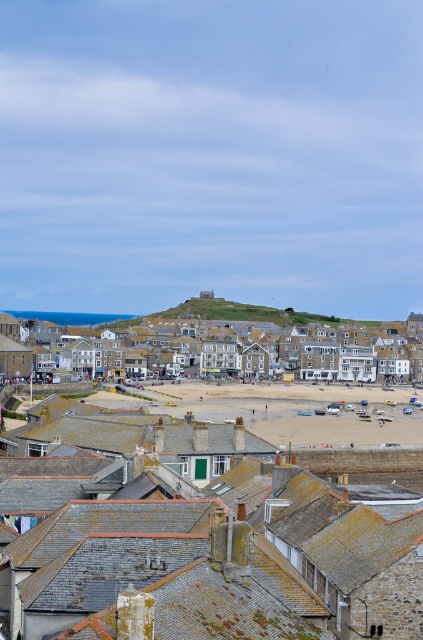
From the picture: Can you confirm if beige stone buildings at center is positioned below smooth stone hillside at center?

Indeed, beige stone buildings at center is positioned under smooth stone hillside at center.

Does beige stone buildings at center appear over smooth stone hillside at center?

No, beige stone buildings at center is not above smooth stone hillside at center.

Is point (208, 364) positioned in front of point (242, 307)?

Yes, it is.

Where is `beige stone buildings at center`? Image resolution: width=423 pixels, height=640 pixels. beige stone buildings at center is located at coordinates (338, 355).

Does beige sand at center appear on the left side of smooth stone hillside at center?

In fact, beige sand at center is to the right of smooth stone hillside at center.

The width and height of the screenshot is (423, 640). Describe the element at coordinates (286, 412) in the screenshot. I see `beige sand at center` at that location.

Where is `beige sand at center`? The width and height of the screenshot is (423, 640). beige sand at center is located at coordinates (286, 412).

Between beige sand at center and beige stone buildings at center, which one has more height?

Standing taller between the two is beige stone buildings at center.

Which is more to the right, beige sand at center or beige stone buildings at center?

From the viewer's perspective, beige sand at center appears more on the right side.

Is point (359, 433) positioned before point (285, 346)?

Yes, point (359, 433) is closer to viewer.

Where is `beige sand at center`? Image resolution: width=423 pixels, height=640 pixels. beige sand at center is located at coordinates (286, 412).